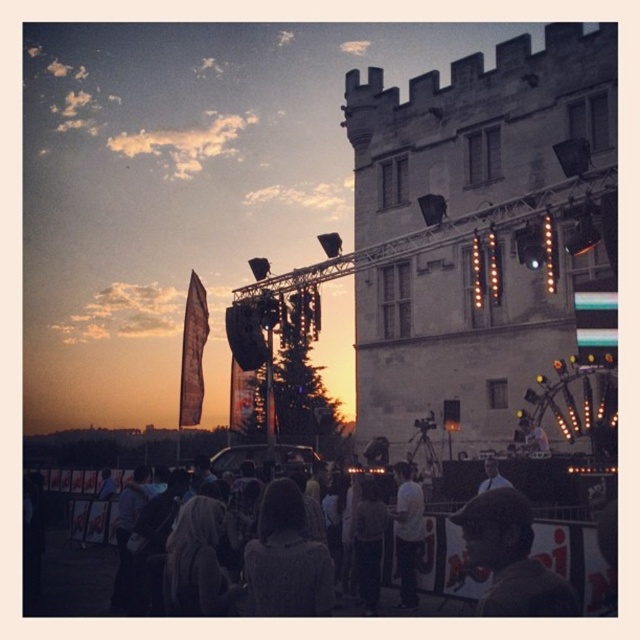
Question: Considering the real-world distances, which object is farthest from the knitted gray sweater at center?

Choices:
 (A) dark brown leather jacket at lower right
 (B) white cotton shirt at center
 (C) light brown hair at center

Answer: (C)

Question: Is white cotton shirt at center bigger than light brown hair at center?

Choices:
 (A) no
 (B) yes

Answer: (B)

Question: Which point is farther from the camera taking this photo?

Choices:
 (A) (419, 497)
 (B) (282, 493)

Answer: (A)

Question: Does dark brown leather jacket at lower right appear over light brown hair at center?

Choices:
 (A) no
 (B) yes

Answer: (A)

Question: Which point is closer to the camera?

Choices:
 (A) light brown hair at center
 (B) dark brown leather jacket at lower right
 (C) white cotton shirt at center

Answer: (B)

Question: Is dark brown leather jacket at lower right further to the viewer compared to white cotton shirt at center?

Choices:
 (A) no
 (B) yes

Answer: (A)